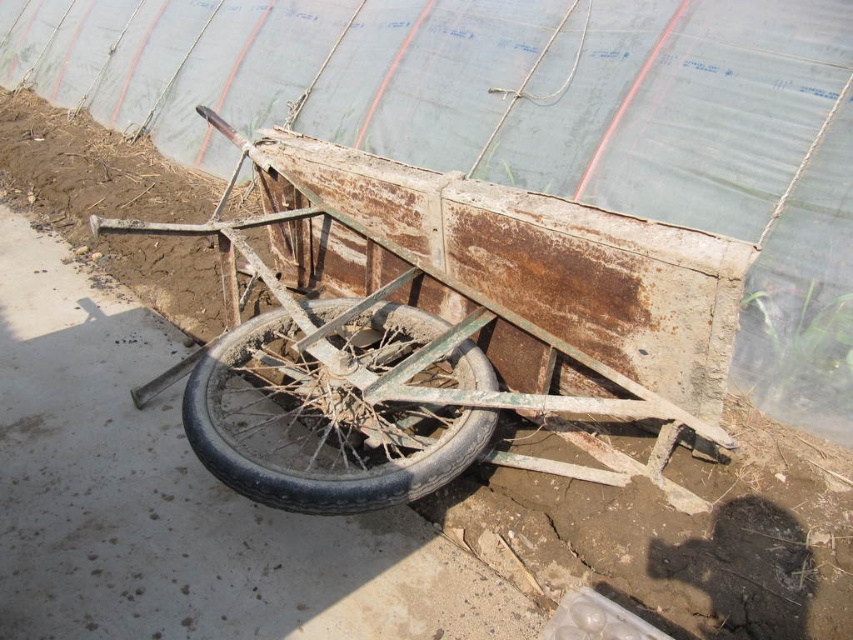
The width and height of the screenshot is (853, 640). I want to click on rusty metal cart at center, so click(x=439, y=326).

Is rusty metal cart at center wider than rusty metal wheel at lower center?

Indeed, rusty metal cart at center has a greater width compared to rusty metal wheel at lower center.

Image resolution: width=853 pixels, height=640 pixels. Describe the element at coordinates (439, 326) in the screenshot. I see `rusty metal cart at center` at that location.

This screenshot has height=640, width=853. In order to click on rusty metal cart at center in this screenshot , I will do `click(439, 326)`.